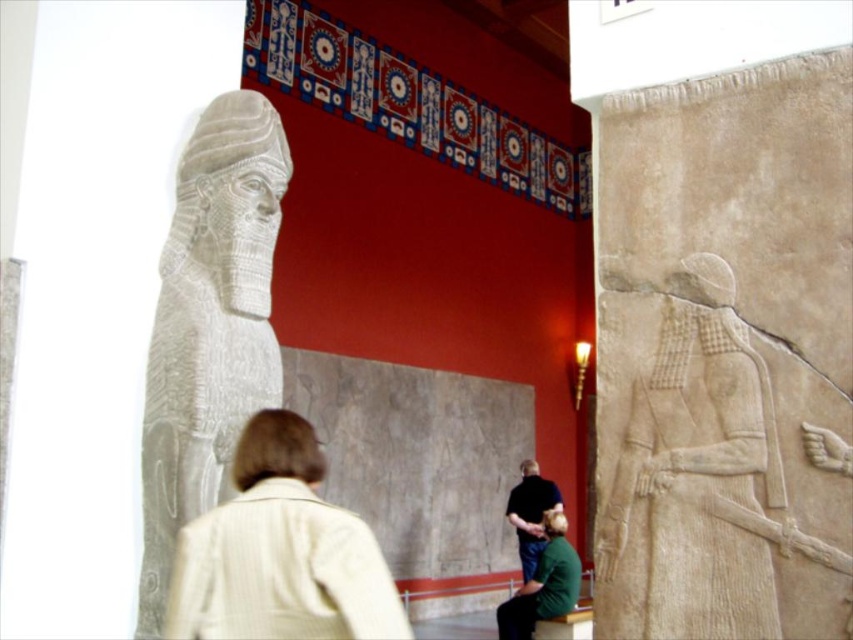
Question: Which object is positioned farthest from the gray stone relief at center?

Choices:
 (A) dark blue shirt at center
 (B) white stone statue at left
 (C) light beige jacket at center

Answer: (A)

Question: Which object is closer to the camera taking this photo?

Choices:
 (A) dark blue shirt at center
 (B) gray stone relief at center
 (C) white stone statue at left

Answer: (B)

Question: From the image, what is the correct spatial relationship of gray stone relief at center in relation to dark blue shirt at center?

Choices:
 (A) left
 (B) right

Answer: (A)

Question: Is light beige jacket at center to the right of dark blue shirt at center from the viewer's perspective?

Choices:
 (A) yes
 (B) no

Answer: (B)

Question: Estimate the real-world distances between objects in this image. Which object is farther from the gray stone relief at center?

Choices:
 (A) light beige jacket at center
 (B) dark blue shirt at center
 (C) white stone statue at left

Answer: (B)

Question: Is white stone statue at left below dark blue shirt at center?

Choices:
 (A) yes
 (B) no

Answer: (B)